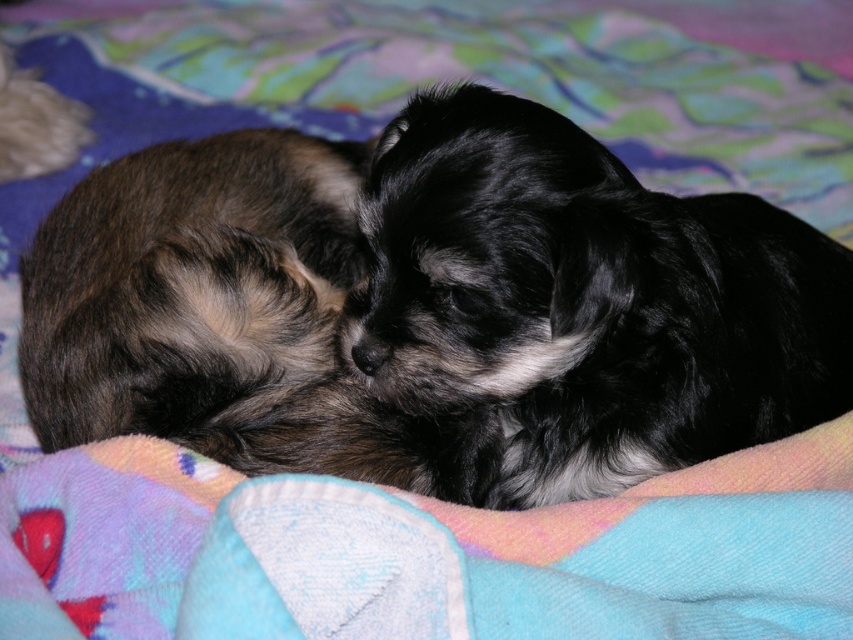
Question: Which of the following is the farthest from the observer?

Choices:
 (A) tap(19, 74)
 (B) tap(392, 173)

Answer: (A)

Question: Which point is farther to the camera?

Choices:
 (A) (782, 326)
 (B) (32, 86)

Answer: (B)

Question: Which object appears closest to the camera in this image?

Choices:
 (A) soft brown fur at upper left
 (B) black fluffy dog at center

Answer: (B)

Question: Is black fluffy dog at center thinner than soft brown fur at upper left?

Choices:
 (A) yes
 (B) no

Answer: (B)

Question: Does black fluffy dog at center have a lesser width compared to soft brown fur at upper left?

Choices:
 (A) no
 (B) yes

Answer: (A)

Question: Is black fluffy dog at center behind soft brown fur at upper left?

Choices:
 (A) no
 (B) yes

Answer: (A)